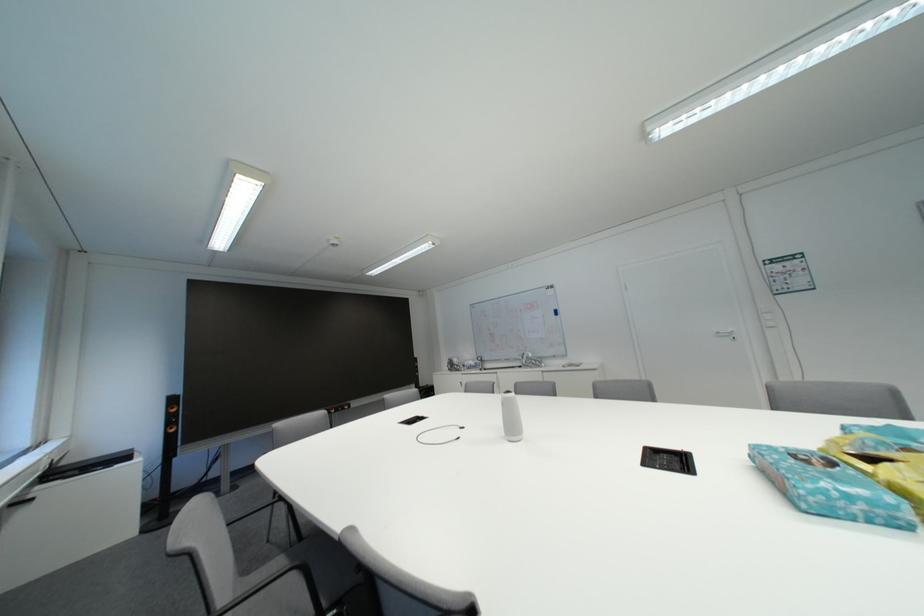
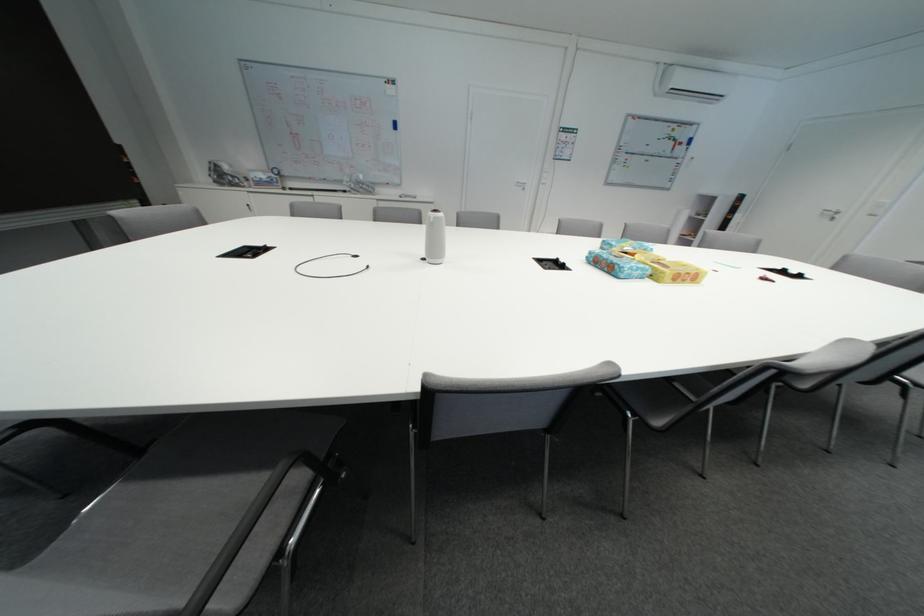
The point at (858, 500) is marked in the first image. Where is the corresponding point in the second image?

(648, 272)